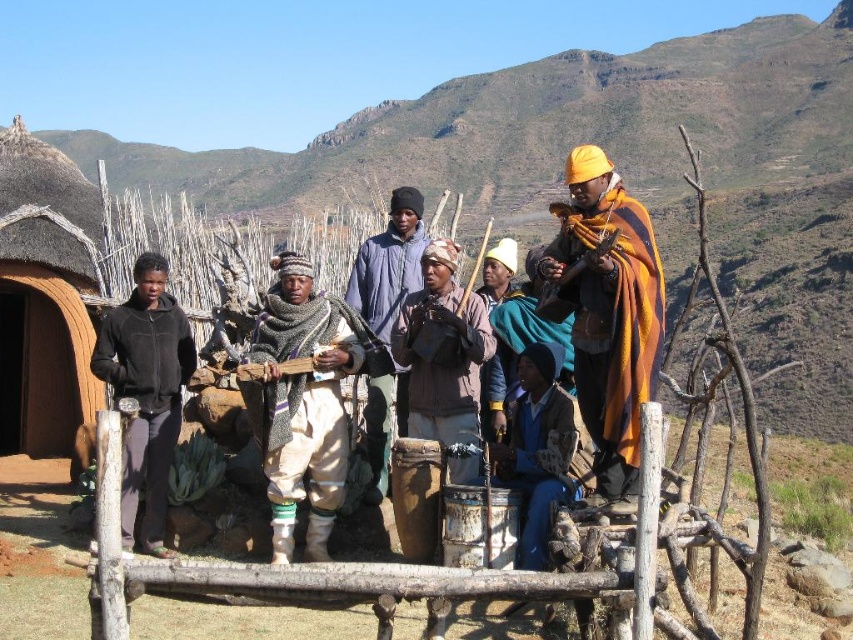
What is located at the coordinates point (607, 310) in the image?

The orange woolen shawl at center is located at point (607, 310).